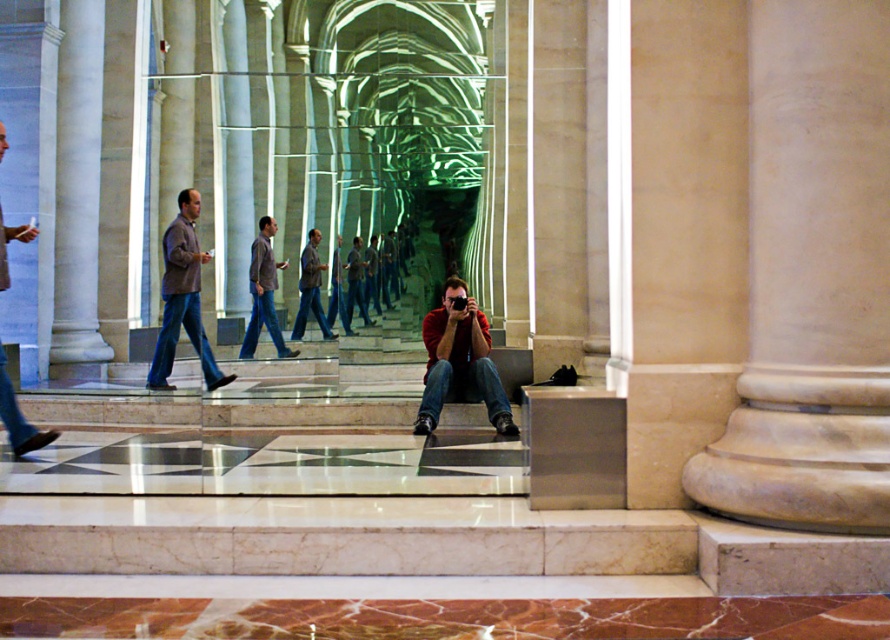
Question: Can you confirm if matte brown jacket at left is bigger than dark brown leather jacket at center?

Choices:
 (A) yes
 (B) no

Answer: (B)

Question: Is matte brown jacket at center above matte brown jacket at left?

Choices:
 (A) no
 (B) yes

Answer: (B)

Question: Based on their relative distances, which object is nearer to the dark brown leather jacket at center?

Choices:
 (A) matte red shirt at center
 (B) matte brown jacket at left
 (C) brown woolen jacket at left

Answer: (C)

Question: Does matte red shirt at center appear under matte brown jacket at left?

Choices:
 (A) no
 (B) yes

Answer: (A)

Question: Which object appears closest to the camera in this image?

Choices:
 (A) matte red shirt at center
 (B) matte brown jacket at left

Answer: (B)

Question: Which object is closer to the camera taking this photo?

Choices:
 (A) brown woolen jacket at left
 (B) matte brown jacket at left
 (C) dark brown leather jacket at center

Answer: (B)